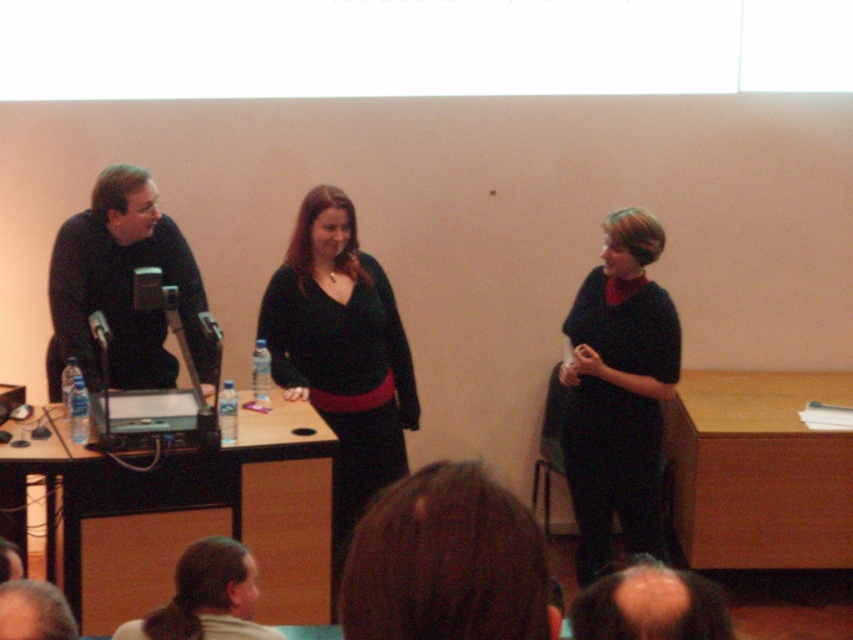
Does matte black microphone at left appear on the left side of light brown hair at lower center?

Correct, you'll find matte black microphone at left to the left of light brown hair at lower center.

Is point (109, 230) in front of point (206, 552)?

No.

Where is `matte black microphone at left`? This screenshot has width=853, height=640. matte black microphone at left is located at coordinates (122, 288).

Between matte black sweater at right and matte black microphone at left, which one is positioned lower?

matte black sweater at right

Which is more to the left, matte black sweater at right or matte black microphone at left?

From the viewer's perspective, matte black microphone at left appears more on the left side.

Is point (613, 406) farther from camera compared to point (126, 360)?

That is False.

The height and width of the screenshot is (640, 853). Identify the location of matte black sweater at right. (618, 392).

Is matte black sweater at center bigger than matte black sweater at right?

Yes, matte black sweater at center is bigger than matte black sweater at right.

Does matte black sweater at center come in front of matte black sweater at right?

No.

Who is more distant from viewer, (x=390, y=408) or (x=569, y=436)?

The point (x=390, y=408) is more distant.

Locate an element on the screen. The height and width of the screenshot is (640, 853). matte black sweater at center is located at coordinates (341, 355).